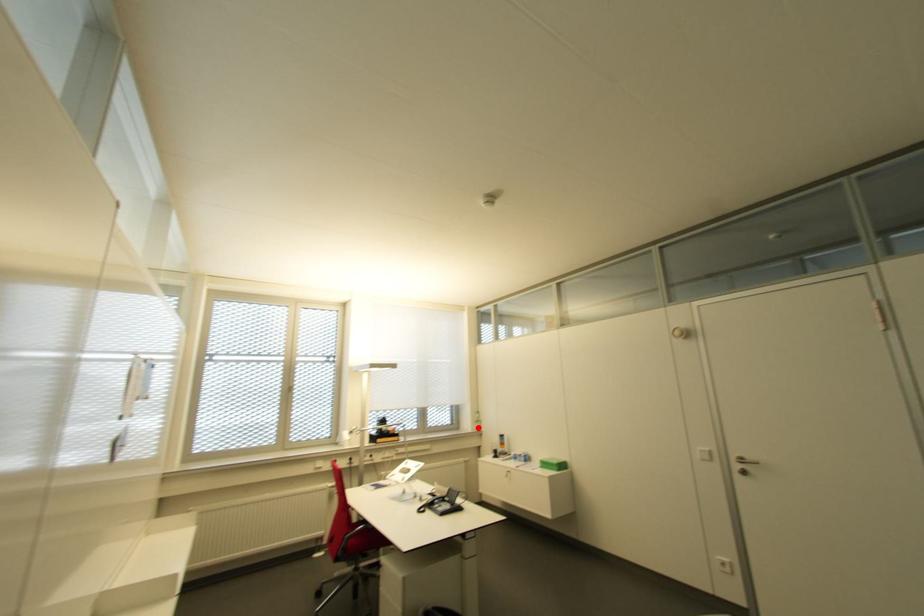
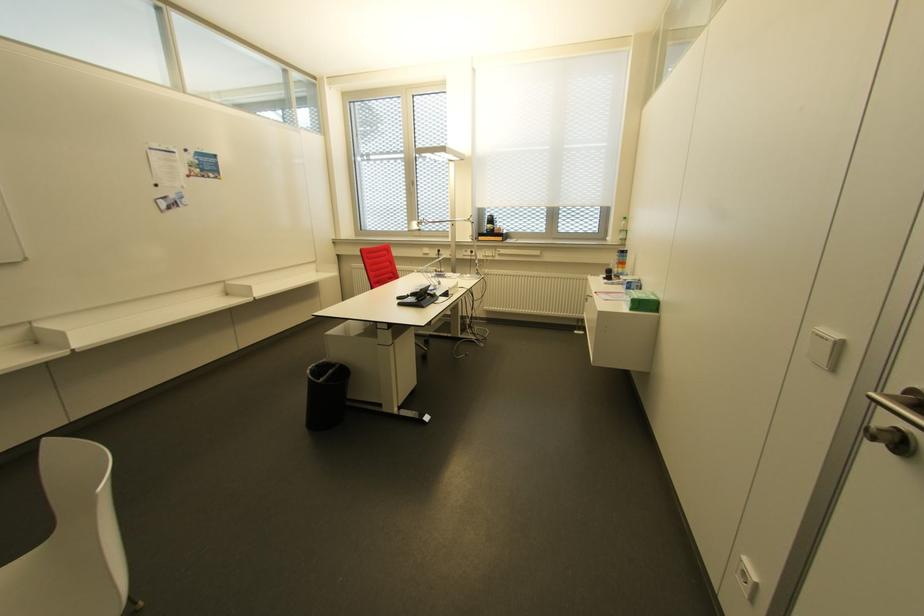
In the second image, find the point that corresponds to the highlighted location in the first image.

(623, 240)